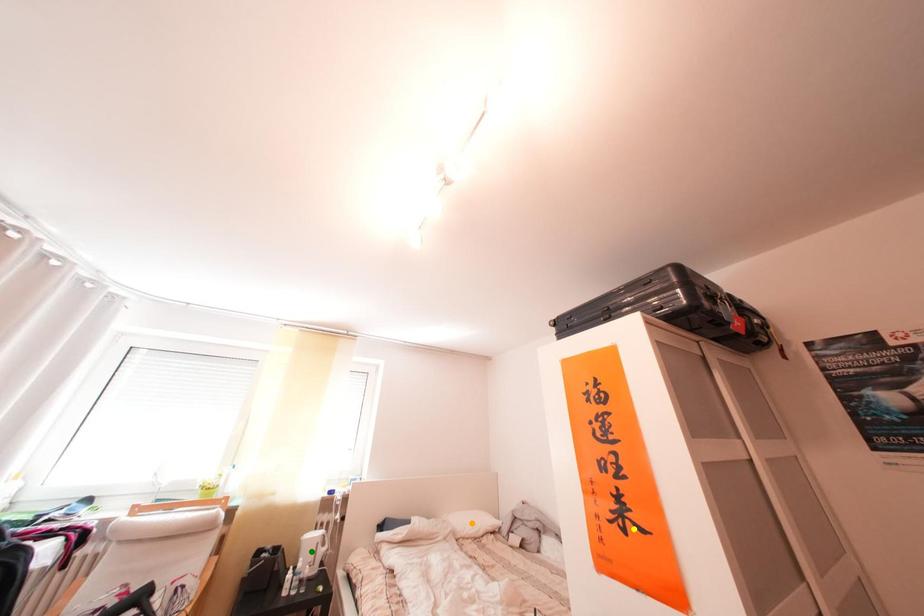
Consider the image. Order these from nearest to farthest:
- green point
- orange point
- yellow point

orange point → green point → yellow point